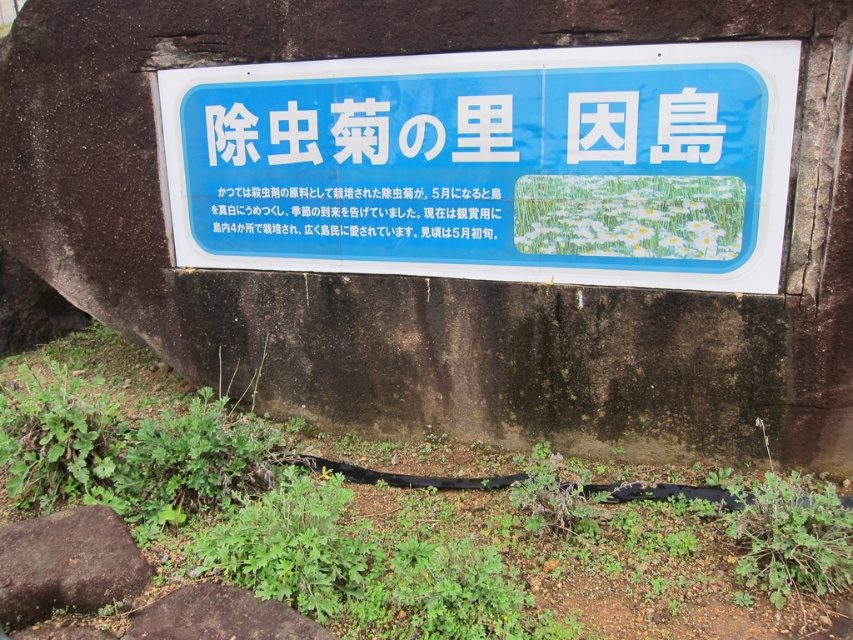
Question: Which point is closer to the camera?

Choices:
 (A) (283, 76)
 (B) (242, 220)
 (C) (209, 598)

Answer: (C)

Question: Which is farther from the blue plastic sign at center?

Choices:
 (A) brown rough rock at lower left
 (B) white paper text at center

Answer: (A)

Question: Can you confirm if blue plastic sign at center is thinner than white paper text at center?

Choices:
 (A) yes
 (B) no

Answer: (B)

Question: Is blue plastic sign at center thinner than brown rough stone at lower center?

Choices:
 (A) yes
 (B) no

Answer: (B)

Question: Can you confirm if blue plastic sign at center is wider than brown rough stone at lower center?

Choices:
 (A) no
 (B) yes

Answer: (B)

Question: Which point is closer to the camera?

Choices:
 (A) (218, 230)
 (B) (543, 276)

Answer: (B)